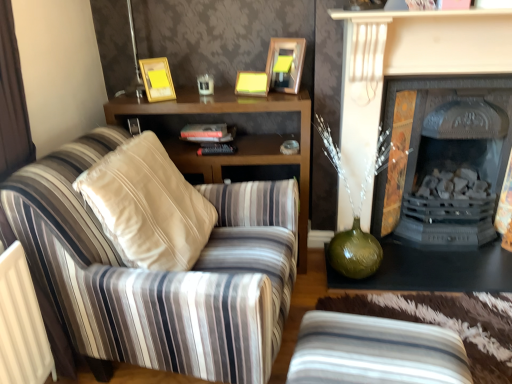
Question: Does wooden cabinet at center have a larger size compared to matte black fireplace at center, acting as the first fireplace starting from the front?

Choices:
 (A) yes
 (B) no

Answer: (A)

Question: Is wooden cabinet at center positioned far away from matte black fireplace at center, acting as the first fireplace starting from the front?

Choices:
 (A) yes
 (B) no

Answer: (B)

Question: Can you confirm if wooden cabinet at center is shorter than matte black fireplace at center, acting as the first fireplace starting from the front?

Choices:
 (A) no
 (B) yes

Answer: (B)

Question: Is matte black fireplace at center, acting as the second fireplace starting from the back, at the back of wooden cabinet at center?

Choices:
 (A) no
 (B) yes

Answer: (A)

Question: Can you confirm if wooden cabinet at center is positioned to the right of matte black fireplace at center, acting as the first fireplace starting from the front?

Choices:
 (A) no
 (B) yes

Answer: (A)

Question: Is black cast iron fireplace at right, which ranks as the first fireplace in back-to-front order, wider or thinner than matte gold picture frame at upper center, marked as the second picture frame in a left-to-right arrangement?

Choices:
 (A) wide
 (B) thin

Answer: (A)

Question: In the image, is black cast iron fireplace at right, which is counted as the 2th fireplace, starting from the front, positioned in front of or behind matte gold picture frame at upper center, the 1th picture frame from the right?

Choices:
 (A) behind
 (B) front

Answer: (B)

Question: From a real-world perspective, relative to matte gold picture frame at upper center, the 1th picture frame from the right, is black cast iron fireplace at right, which ranks as the first fireplace in back-to-front order, vertically above or below?

Choices:
 (A) above
 (B) below

Answer: (B)

Question: Choose the correct answer: Is black cast iron fireplace at right, which is counted as the 2th fireplace, starting from the front, inside matte gold picture frame at upper center, marked as the second picture frame in a left-to-right arrangement, or outside it?

Choices:
 (A) inside
 (B) outside

Answer: (B)

Question: Is point (346, 127) closer or farther from the camera than point (204, 114)?

Choices:
 (A) closer
 (B) farther

Answer: (B)

Question: Is matte black fireplace at center, acting as the first fireplace starting from the front, taller or shorter than wooden cabinet at center?

Choices:
 (A) tall
 (B) short

Answer: (A)

Question: From the image's perspective, is matte black fireplace at center, acting as the first fireplace starting from the front, located above or below wooden cabinet at center?

Choices:
 (A) below
 (B) above

Answer: (B)

Question: From a real-world perspective, relative to wooden cabinet at center, is matte black fireplace at center, acting as the second fireplace starting from the back, vertically above or below?

Choices:
 (A) above
 (B) below

Answer: (A)

Question: Considering the positions of point (231, 112) and point (190, 357), is point (231, 112) closer or farther from the camera than point (190, 357)?

Choices:
 (A) farther
 (B) closer

Answer: (A)

Question: From a real-world perspective, is wooden cabinet at center physically located above or below striped fabric armchair at left?

Choices:
 (A) below
 (B) above

Answer: (A)